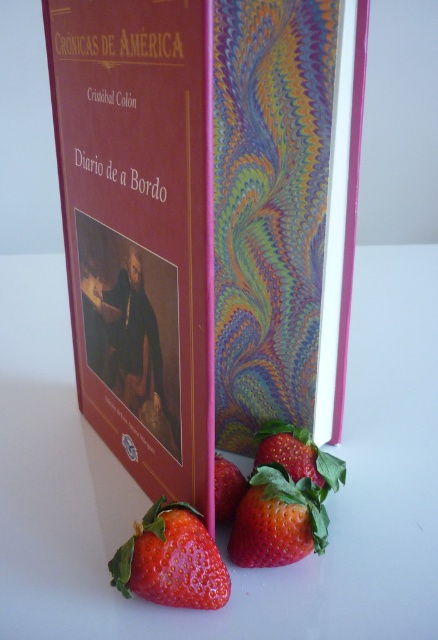
The image size is (438, 640). Describe the element at coordinates (204, 221) in the screenshot. I see `marbled paper book at center` at that location.

Is marbled paper book at center taller than red matte strawberry at lower center?

Indeed, marbled paper book at center has a greater height compared to red matte strawberry at lower center.

The image size is (438, 640). Find the location of `marbled paper book at center`. marbled paper book at center is located at coordinates 204,221.

Is point (289, 326) farther from viewer compared to point (137, 588)?

Yes, point (289, 326) is farther from viewer.

Who is positioned more to the right, marbled paper book at center or red matte strawberry at lower left?

red matte strawberry at lower left is more to the right.

Which is behind, point (243, 97) or point (120, 548)?

Point (243, 97)

Identify the location of marbled paper book at center. (204, 221).

Does point (276, 611) come farther from viewer compared to point (177, 573)?

Yes, it is behind point (177, 573).

Does smooth white table at center appear over red matte strawberry at lower left?

Correct, smooth white table at center is located above red matte strawberry at lower left.

Measure the distance between point (x=14, y=396) and camera.

Point (x=14, y=396) is 4.02 feet from camera.

Locate an element on the screen. smooth white table at center is located at coordinates (148, 502).